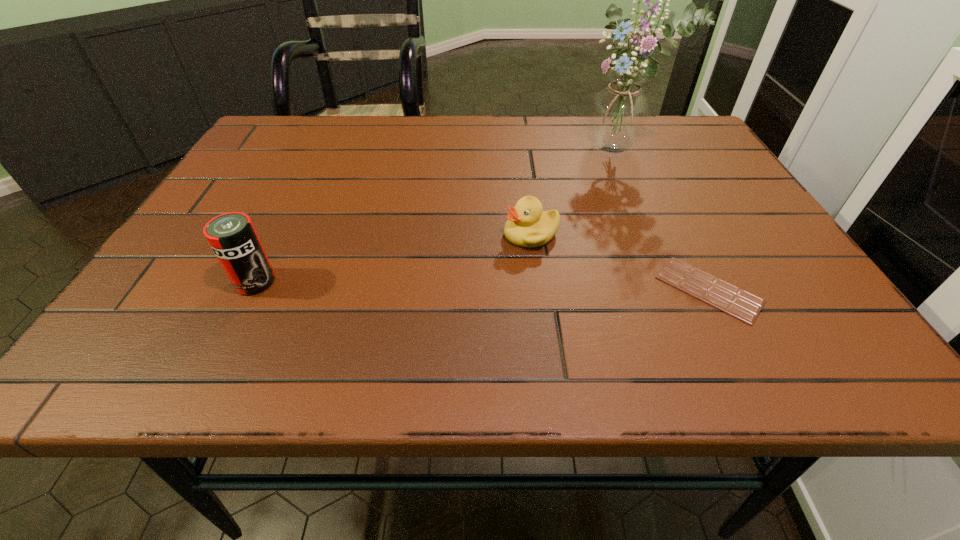
At what (x,y) coordinates should I click in order to perform the action: click on free space on the desktop that is between the can and the shortest object and is positioned on the front-facing side of the tallest object. Please return your answer as a coordinate pair (x, y). The height and width of the screenshot is (540, 960). Looking at the image, I should click on (477, 286).

I want to click on vacant space on the desktop that is between the third shortest object and the shortest object and is positioned on the front-facing side of the second shortest object, so click(433, 285).